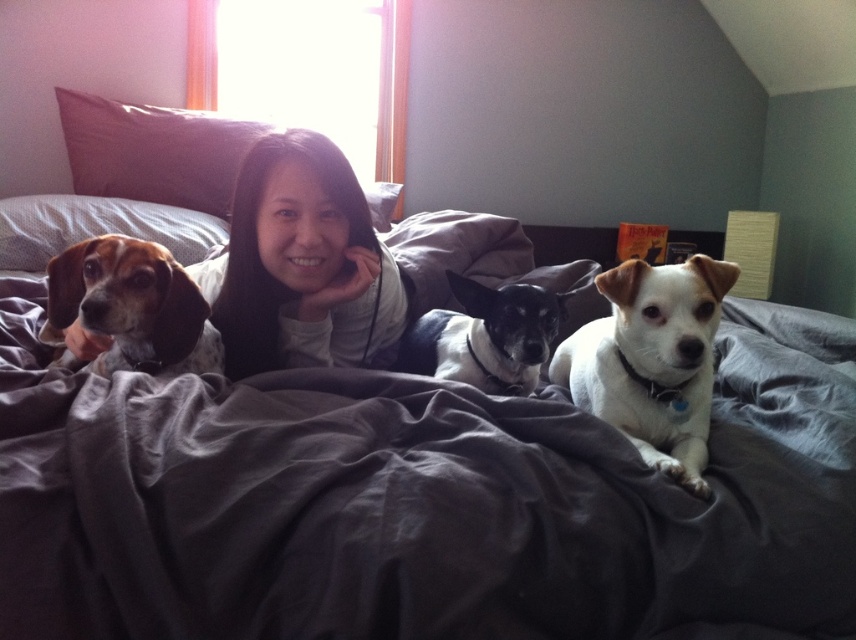
Does smooth skin at center have a smaller size compared to brown and white fur at left?

Actually, smooth skin at center might be larger than brown and white fur at left.

Who is higher up, smooth skin at center or brown and white fur at left?

Positioned higher is smooth skin at center.

Who is more forward, [259,285] or [165,262]?

Point [165,262] is more forward.

Find the location of a particular element. The height and width of the screenshot is (640, 856). smooth skin at center is located at coordinates (301, 262).

Between brown and white fur at left and black and white fur at center, which one appears on the left side from the viewer's perspective?

brown and white fur at left

Which is behind, point (147, 324) or point (411, 339)?

The point (411, 339) is behind.

You are a GUI agent. You are given a task and a screenshot of the screen. Output one action in this format:
    pyautogui.click(x=<x>, y=<y>)
    Task: Click on the brown and white fur at left
    The image size is (856, 640).
    Given the screenshot: What is the action you would take?
    pyautogui.click(x=134, y=305)

Can you confirm if smooth skin at center is bigger than brown fabric pillow at upper center?

Indeed, smooth skin at center has a larger size compared to brown fabric pillow at upper center.

Is smooth skin at center above brown fabric pillow at upper center?

No, smooth skin at center is not above brown fabric pillow at upper center.

Does point (277, 320) come farther from viewer compared to point (158, 116)?

No, (277, 320) is closer to viewer.

This screenshot has height=640, width=856. Find the location of `smooth skin at center`. smooth skin at center is located at coordinates (301, 262).